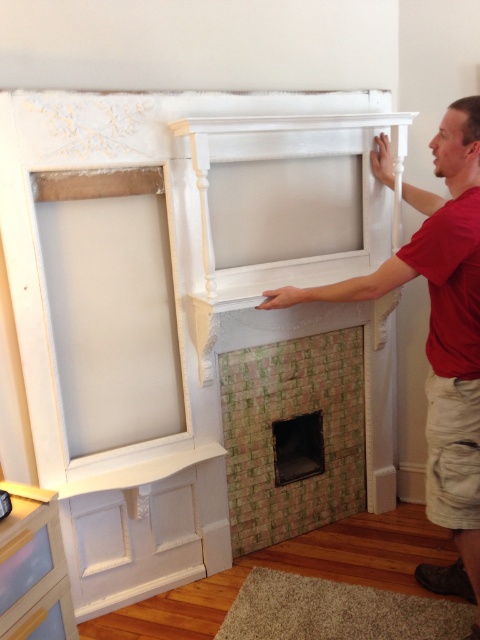
Question: Is matte white fireplace at right to the left of green mosaic tile fireplace at center from the viewer's perspective?

Choices:
 (A) yes
 (B) no

Answer: (B)

Question: Among these points, which one is nearest to the camera?

Choices:
 (A) (75, 330)
 (B) (470, 301)

Answer: (B)

Question: Which of the following is the farthest from the observer?

Choices:
 (A) matte white fireplace at right
 (B) green mosaic tile fireplace at center
 (C) white painted wood window frame at upper left

Answer: (B)

Question: Based on their relative distances, which object is farther from the matte white fireplace at right?

Choices:
 (A) green mosaic tile fireplace at center
 (B) white painted wood window frame at upper left

Answer: (A)

Question: Can you confirm if white painted wood window frame at upper left is positioned to the left of green mosaic tile fireplace at center?

Choices:
 (A) no
 (B) yes

Answer: (B)

Question: In this image, where is white painted wood window frame at upper left located relative to green mosaic tile fireplace at center?

Choices:
 (A) right
 (B) left

Answer: (B)